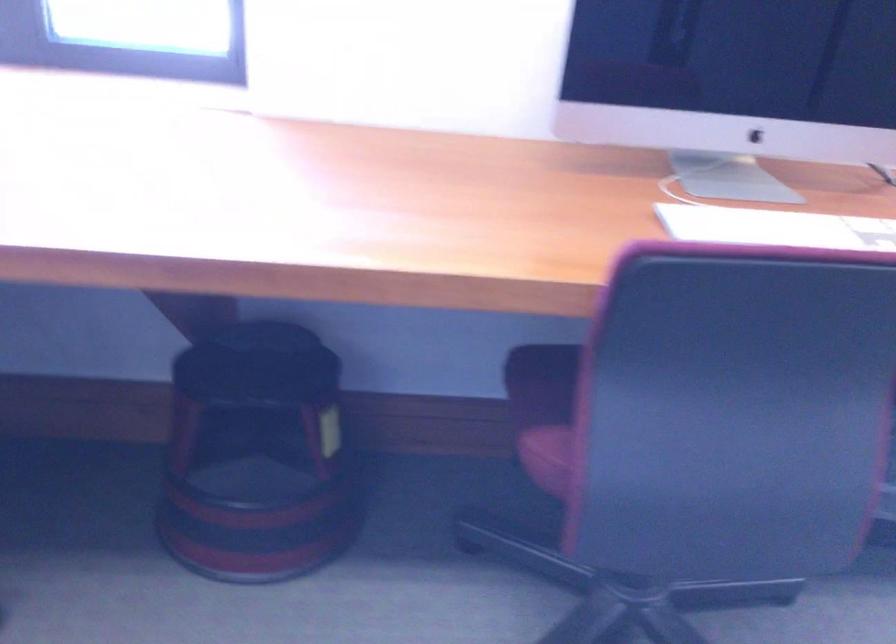
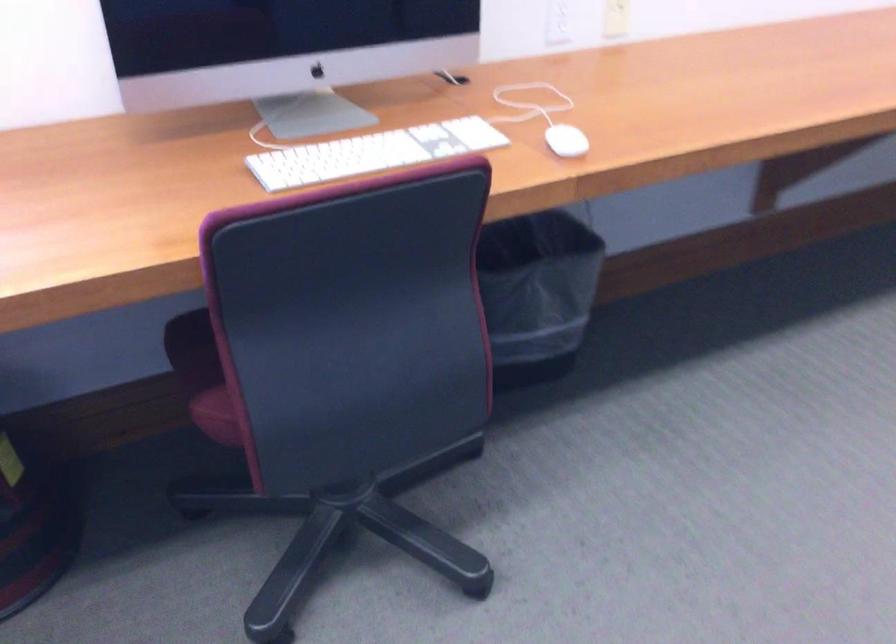
The point at [797,225] is marked in the first image. Where is the corresponding point in the second image?

(372, 153)